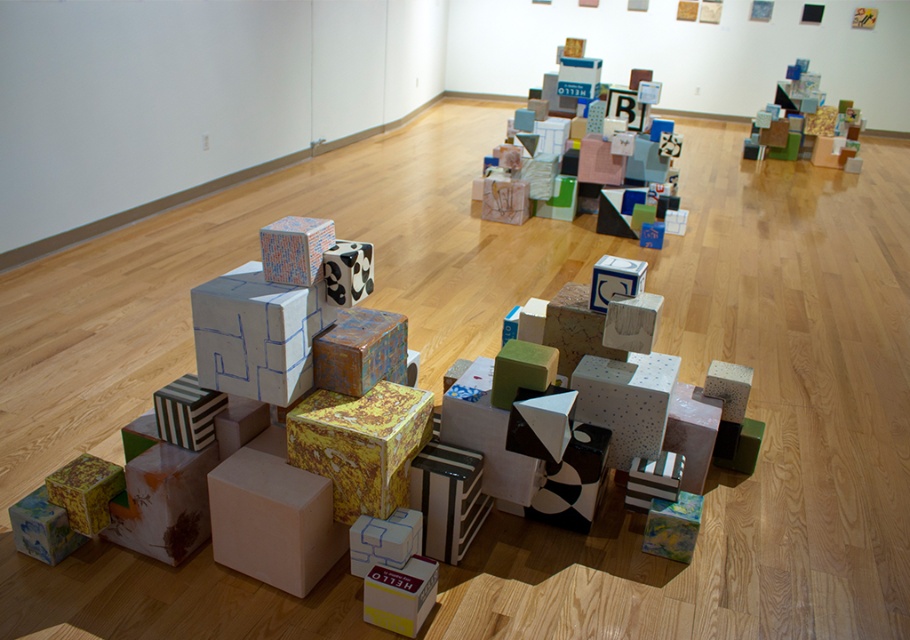
Measure the distance from yellow textured cardboard box at center to matte cardboard box at center.

yellow textured cardboard box at center is 11.46 feet away from matte cardboard box at center.

Who is more forward, (386, 403) or (662, 212)?

Point (386, 403) is in front.

In order to click on yellow textured cardboard box at center in this screenshot , I will do `click(361, 444)`.

Between textured multicolored cube at center and yellow textured cube at lower left, which one appears on the left side from the viewer's perspective?

yellow textured cube at lower left

Can you confirm if textured multicolored cube at center is wider than yellow textured cube at lower left?

Yes, textured multicolored cube at center is wider than yellow textured cube at lower left.

Where is `textured multicolored cube at center`? textured multicolored cube at center is located at coordinates (360, 349).

Is matte cardboard box at center in front of textured multicolored cube at center?

No, matte cardboard box at center is behind textured multicolored cube at center.

The width and height of the screenshot is (910, 640). What are the coordinates of `matte cardboard box at center` in the screenshot? It's located at 617,182.